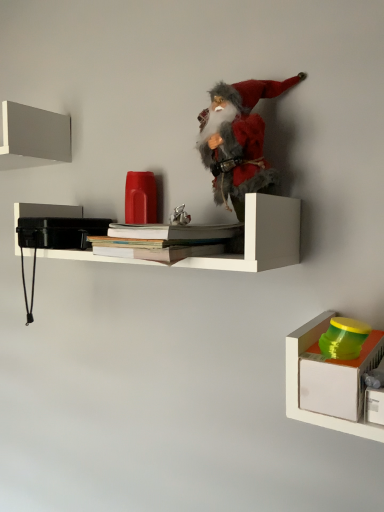
Question: Considering the positions of matte gray shelf at upper left, the first shelf positioned from the left, and white paper book at center, which appears as the second book when ordered from the bottom, in the image, is matte gray shelf at upper left, the first shelf positioned from the left, taller or shorter than white paper book at center, which appears as the second book when ordered from the bottom,?

Choices:
 (A) tall
 (B) short

Answer: (A)

Question: Considering their positions, is matte gray shelf at upper left, acting as the first shelf starting from the top, located in front of or behind white paper book at center, which appears as the second book when ordered from the bottom?

Choices:
 (A) front
 (B) behind

Answer: (B)

Question: Estimate the real-world distances between objects in this image. Which object is closer to the matte gray shelf at upper left, which is the third shelf in bottom-to-top order?

Choices:
 (A) hardcover books at center, placed as the 1th book when sorted from bottom to top
 (B) matte white box at lower right, placed as the first shelf when sorted from right to left
 (C) fuzzy fabric santa at center, which is the second toy in right-to-left order
 (D) green plastic container at lower right, the second toy from the top
 (E) white paper book at center, which appears as the second book when ordered from the bottom

Answer: (A)

Question: Estimate the real-world distances between objects in this image. Which object is closer to the matte white box at lower right, which appears as the 3th shelf when viewed from the left?

Choices:
 (A) matte gray shelf at upper left, the 3th shelf viewed from the right
 (B) fuzzy fabric santa at center, the first toy from the left
 (C) white matte shelf at center, which is the 2th shelf from right to left
 (D) green plastic container at lower right, which is the 1th toy from bottom to top
 (E) white paper book at center, which appears as the second book when ordered from the bottom

Answer: (D)